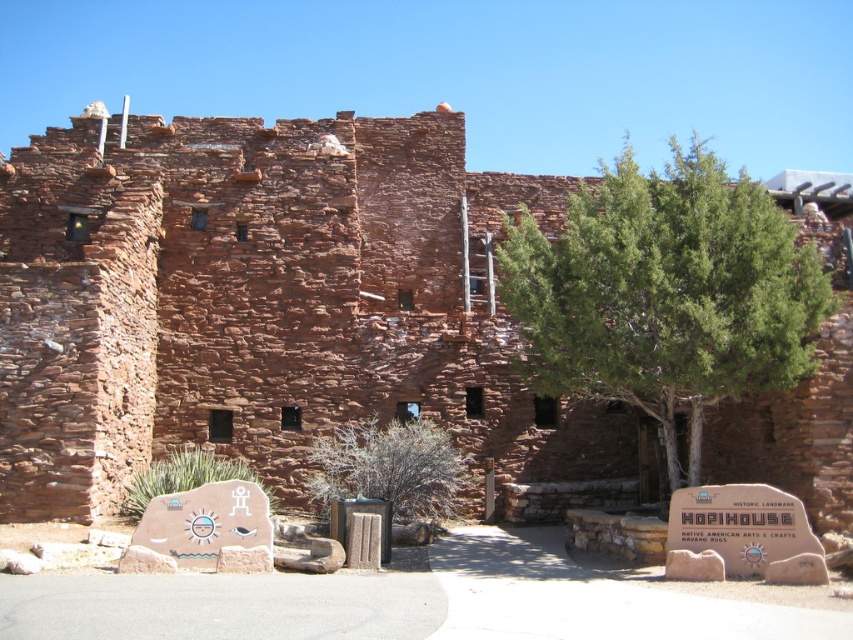
Question: Does green leafy tree at center appear under brown textured bush at center?

Choices:
 (A) yes
 (B) no

Answer: (B)

Question: Based on their relative distances, which object is nearer to the reddish-brown stone wall at center?

Choices:
 (A) brown textured bush at center
 (B) green leafy tree at center

Answer: (A)

Question: Which point appears closest to the camera in this image?

Choices:
 (A) (450, 515)
 (B) (177, 156)

Answer: (A)

Question: Is green leafy tree at center smaller than brown textured bush at center?

Choices:
 (A) yes
 (B) no

Answer: (B)

Question: Does reddish-brown stone wall at center have a greater width compared to green leafy tree at center?

Choices:
 (A) yes
 (B) no

Answer: (A)

Question: Based on their relative distances, which object is nearer to the brown textured bush at center?

Choices:
 (A) reddish-brown stone wall at center
 (B) green leafy tree at center

Answer: (A)